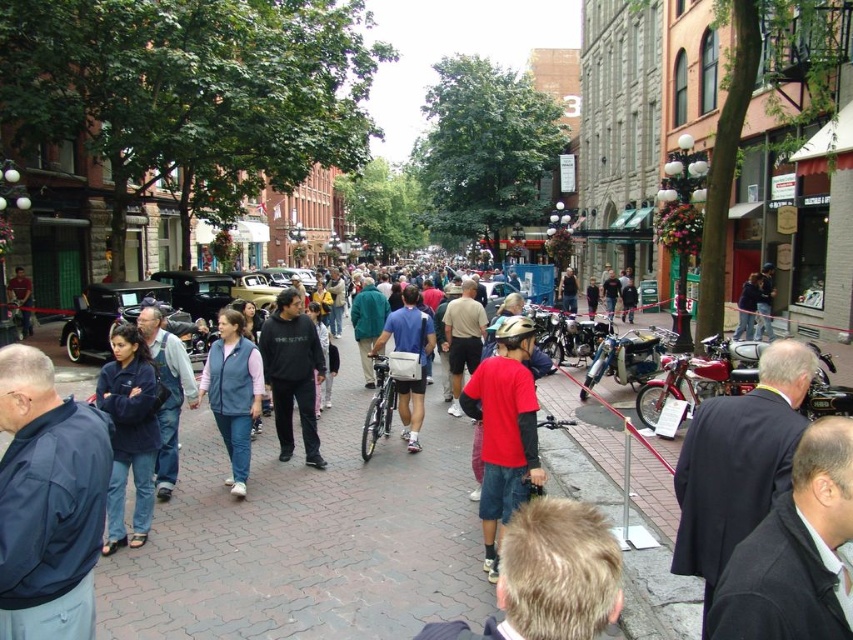
Question: Which point is farther from the camera taking this photo?

Choices:
 (A) (19, 276)
 (B) (502, 349)

Answer: (A)

Question: Does khaki cotton pants at center lie behind denim jacket at center?

Choices:
 (A) yes
 (B) no

Answer: (B)

Question: Is dark blue suit at center closer to camera compared to matte gray backpack at center?

Choices:
 (A) yes
 (B) no

Answer: (A)

Question: Which object is positioned closest to the blue fleece vest at center?

Choices:
 (A) dark gray sweatshirt at center
 (B) blue fabric jacket at left
 (C) dark blue jacket at center

Answer: (A)

Question: Considering the relative positions of brick pavement at center and matte gray backpack at center in the image provided, where is brick pavement at center located with respect to matte gray backpack at center?

Choices:
 (A) right
 (B) left

Answer: (B)

Question: Estimate the real-world distances between objects in this image. Which object is farther from the brick pavement at center?

Choices:
 (A) khaki cotton pants at center
 (B) dark blue jacket at center

Answer: (B)